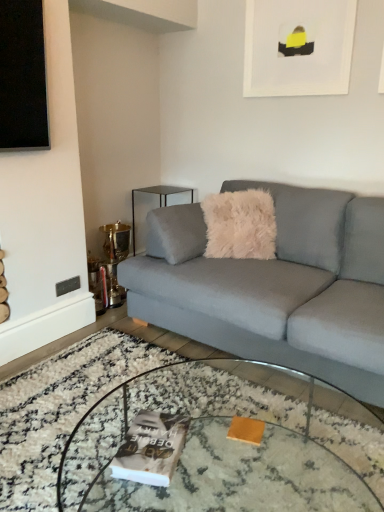
Identify the location of free space to the back side of matte gray magazine at center. (162, 408).